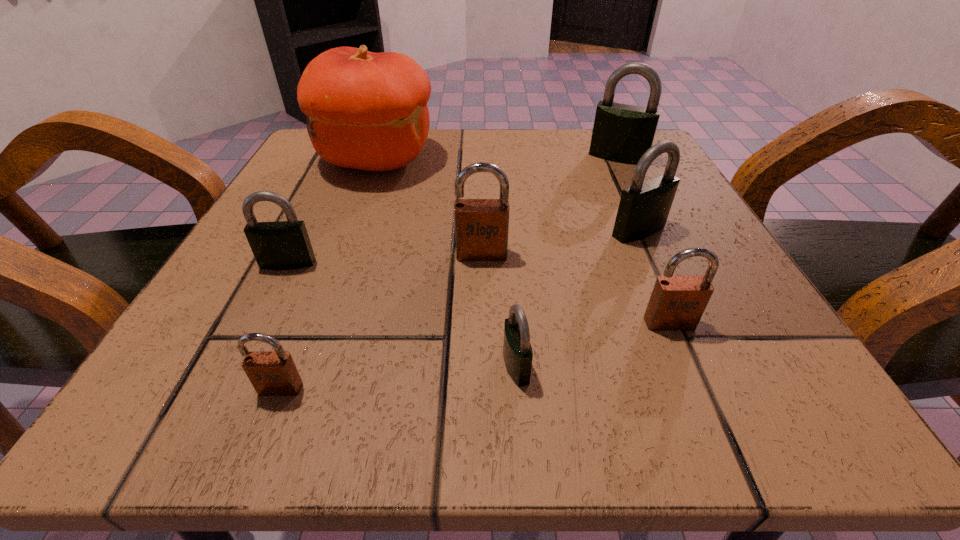
You are a GUI agent. You are given a task and a screenshot of the screen. Output one action in this format:
    pyautogui.click(x=<x>, y=<y>)
    Task: Click on the brown padlock that is the closest to the rightmost brown padlock
    Image resolution: width=960 pixels, height=540 pixels.
    Given the screenshot: What is the action you would take?
    pyautogui.click(x=481, y=225)

Locate which brown padlock ranks second in proximity to the leftmost black padlock. Please provide its 2D coordinates. Your answer should be formatted as a tuple, i.e. [(x, y)], where the tuple contains the x and y coordinates of a point satisfying the conditions above.

[(481, 225)]